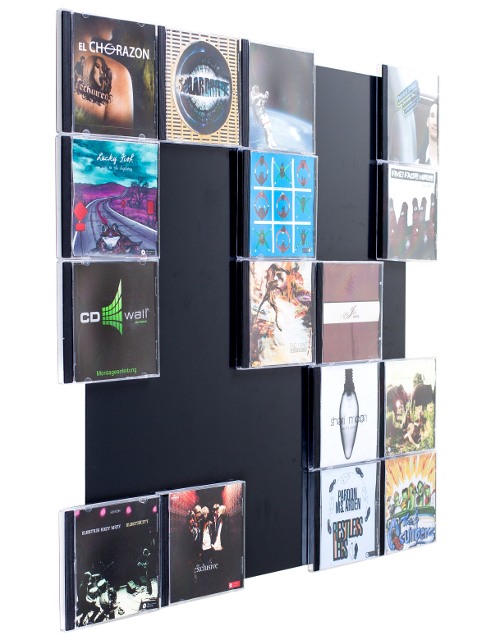
You are a GUI agent. You are given a task and a screenshot of the screen. Output one action in this format:
    pyautogui.click(x=<x>, y=<y>)
    Task: Click on the cds
    The width and height of the screenshot is (500, 640).
    Given the screenshot: What is the action you would take?
    pyautogui.click(x=102, y=312), pyautogui.click(x=119, y=564), pyautogui.click(x=340, y=516), pyautogui.click(x=403, y=489), pyautogui.click(x=358, y=323), pyautogui.click(x=407, y=217), pyautogui.click(x=300, y=200), pyautogui.click(x=291, y=109)